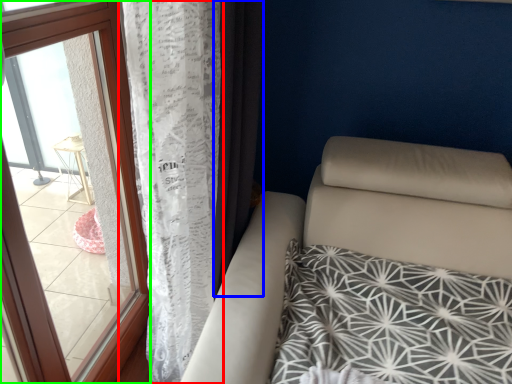
Question: Estimate the real-world distances between objects in this image. Which object is farther from curtain (highlighted by a red box), curtain (highlighted by a blue box) or window (highlighted by a green box)?

Choices:
 (A) curtain
 (B) window

Answer: (B)